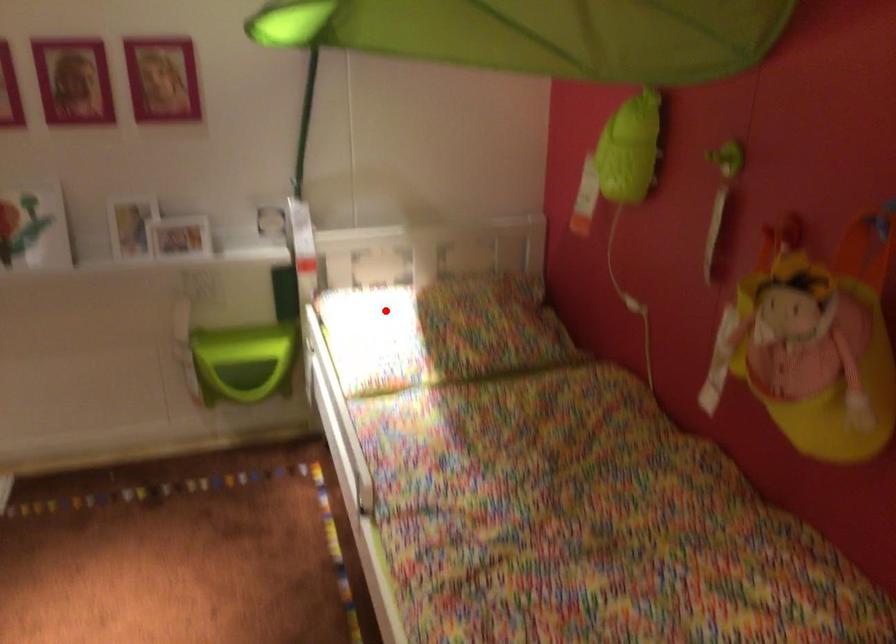
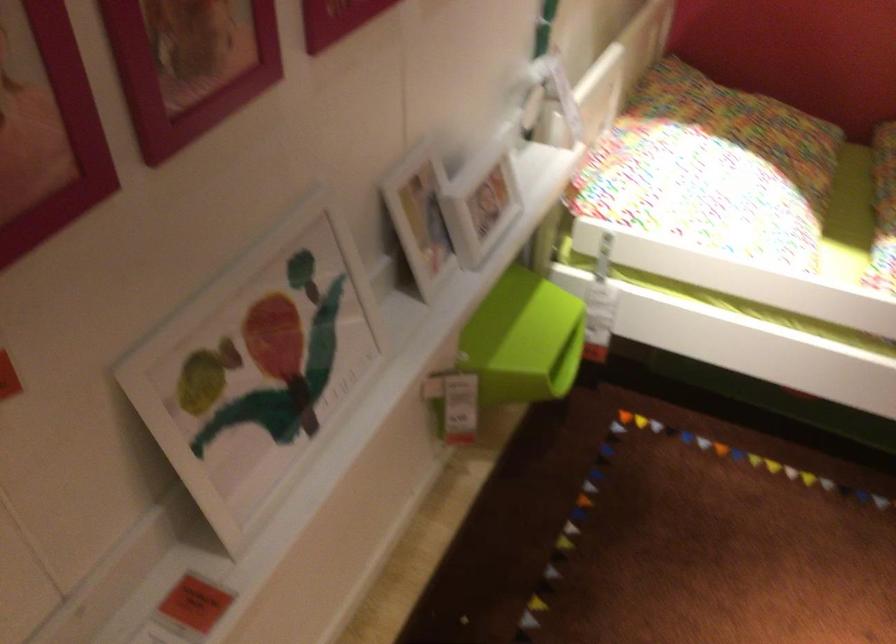
Find the pixel in the second image that matches the highlighted location in the first image.

(712, 169)